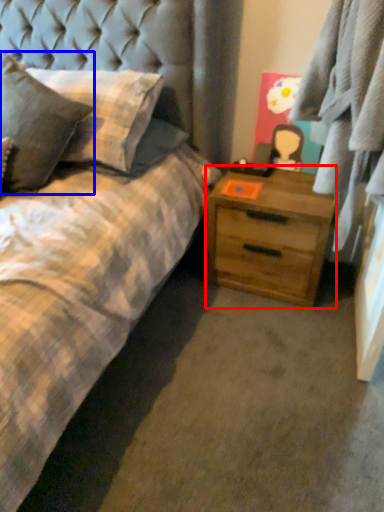
Question: Which point is closer to the camera, chest of drawers (highlighted by a red box) or pillow (highlighted by a blue box)?

Choices:
 (A) chest of drawers
 (B) pillow

Answer: (B)